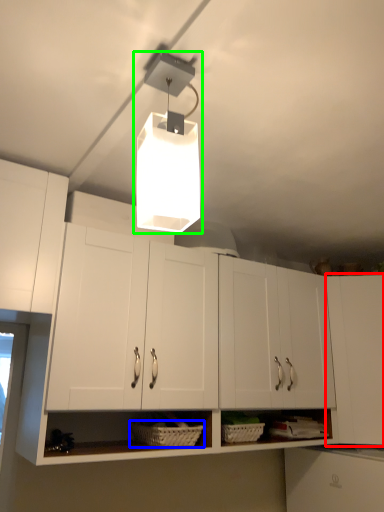
Question: Which object is the farthest from cabinetry (highlighted by a red box)? Choose among these: basket (highlighted by a blue box) or lamp (highlighted by a green box).

Choices:
 (A) basket
 (B) lamp

Answer: (B)